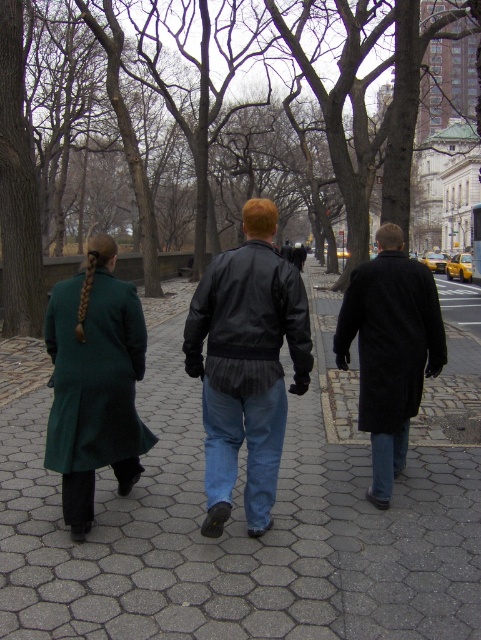
Question: Where is leather jacket at center located in relation to dark wool coat at center in the image?

Choices:
 (A) left
 (B) right

Answer: (A)

Question: Among these points, which one is farthest from the camera?

Choices:
 (A) (419, 298)
 (B) (241, 259)
 (C) (76, 400)
 (D) (88, 259)

Answer: (A)

Question: Is dark wool coat at center smaller than blue denim jeans at center?

Choices:
 (A) no
 (B) yes

Answer: (A)

Question: Which of these objects is positioned closest to the silky brown hair at center?

Choices:
 (A) gray hexagonal paving at center
 (B) green wool coat at left
 (C) dark wool coat at center
 (D) black leather jacket at center

Answer: (B)

Question: Is green wool coat at left in front of jeans at lower right?

Choices:
 (A) no
 (B) yes

Answer: (B)

Question: Among these objects, which one is nearest to the camera?

Choices:
 (A) leather jacket at center
 (B) silky brown hair at center
 (C) dark wool coat at center
 (D) green wool coat at left

Answer: (A)